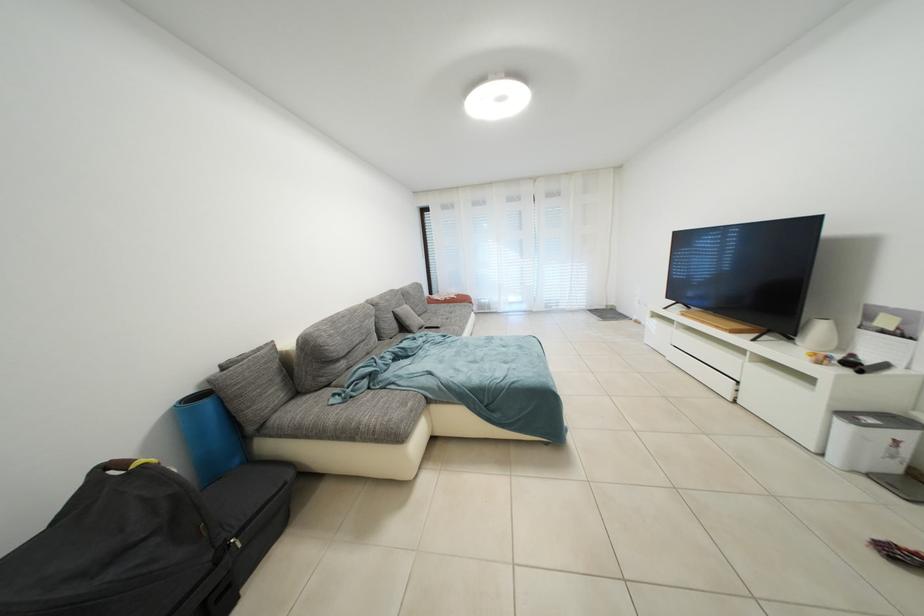
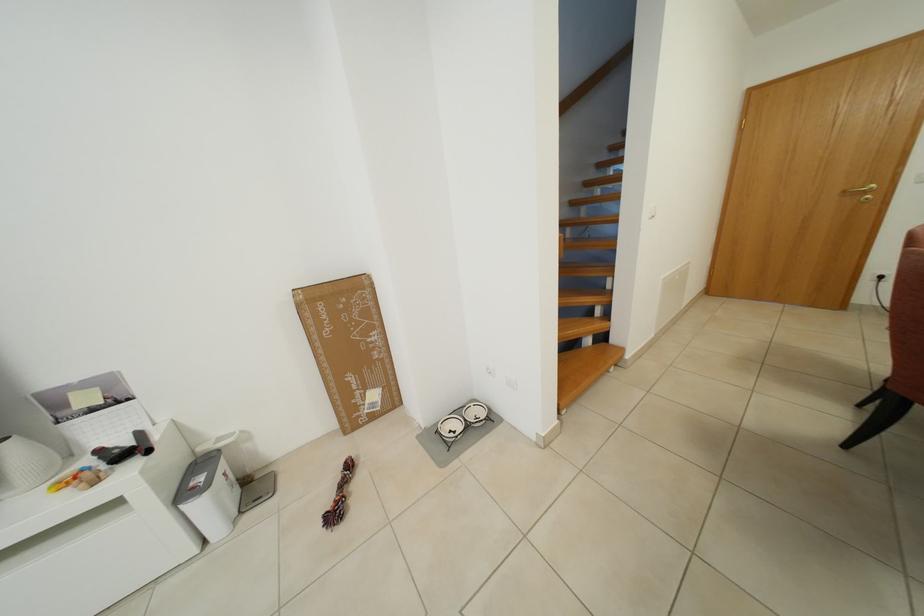
In the second image, find the point that corresponds to [860,361] in the first image.

(108, 455)